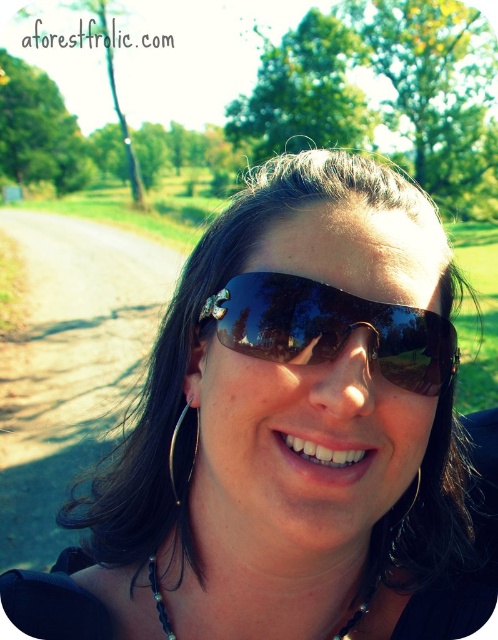
Based on the photo, is shiny black goggles at center further to camera compared to black beaded necklace at center?

That is False.

Is shiny black goggles at center bigger than black beaded necklace at center?

Correct, shiny black goggles at center is larger in size than black beaded necklace at center.

Is point (373, 368) more distant than point (350, 627)?

No, it is in front of (350, 627).

What are the coordinates of `shiny black goggles at center` in the screenshot? It's located at (331, 328).